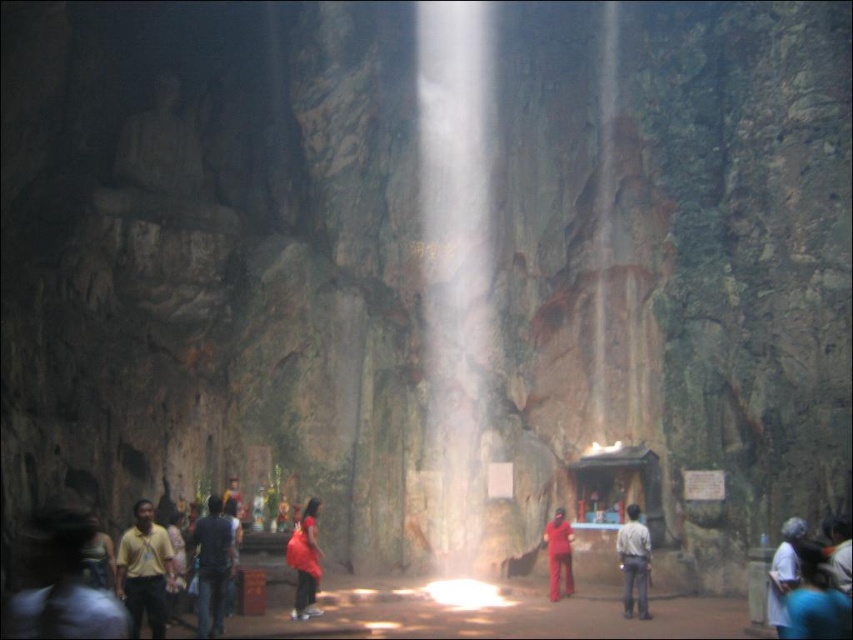
Question: Based on their relative distances, which object is farther from the light gray fabric shirt at center?

Choices:
 (A) matte red pants at center
 (B) matte red dress at center
 (C) dark blue jeans at lower center

Answer: (C)

Question: Does yellow shirt at lower left have a larger size compared to matte red pants at center?

Choices:
 (A) no
 (B) yes

Answer: (B)

Question: Which of these objects is positioned closest to the matte red dress at center?

Choices:
 (A) white matte shirt at lower right
 (B) white translucent waterfall at center
 (C) light gray fabric shirt at center
 (D) matte red pants at center

Answer: (D)

Question: Estimate the real-world distances between objects in this image. Which object is farther from the white translucent waterfall at center?

Choices:
 (A) matte red dress at center
 (B) dark blue jeans at lower center

Answer: (B)

Question: Does matte red dress at center have a greater width compared to white matte shirt at lower right?

Choices:
 (A) no
 (B) yes

Answer: (A)

Question: In this image, where is light gray fabric shirt at center located relative to matte red pants at center?

Choices:
 (A) right
 (B) left

Answer: (A)